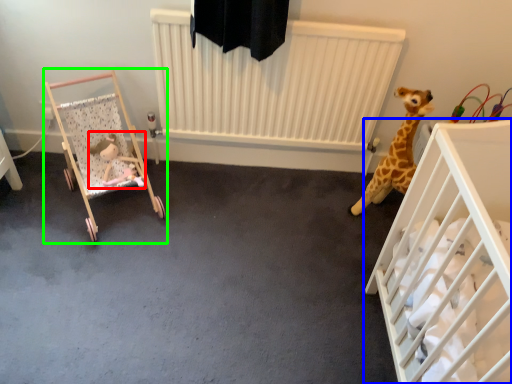
Question: Based on their relative distances, which object is nearer to toy (highlighted by a red box)? Choose from infant bed (highlighted by a blue box) and infant bed (highlighted by a green box).

Choices:
 (A) infant bed
 (B) infant bed

Answer: (B)